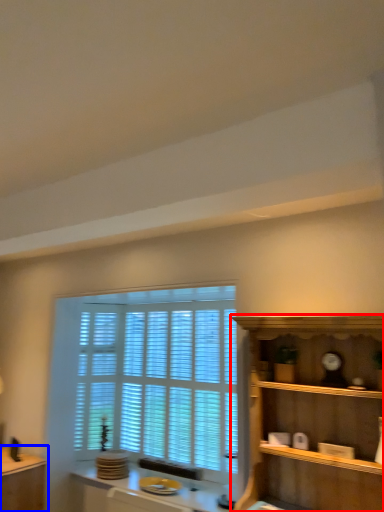
Question: Which of the following is the farthest to the observer, shelf (highlighted by a red box) or table (highlighted by a blue box)?

Choices:
 (A) shelf
 (B) table

Answer: (B)